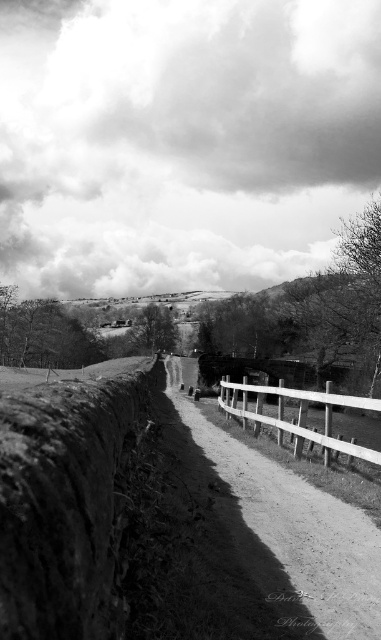
Question: Is dirt/gravel path at center wider than white wooden fence at center?

Choices:
 (A) no
 (B) yes

Answer: (A)

Question: Does dirt/gravel path at center appear on the right side of white wooden fence at center?

Choices:
 (A) no
 (B) yes

Answer: (A)

Question: Which point is closer to the camera taking this photo?

Choices:
 (A) (305, 536)
 (B) (281, 420)

Answer: (A)

Question: Is dirt/gravel path at center bigger than white wooden fence at center?

Choices:
 (A) no
 (B) yes

Answer: (A)